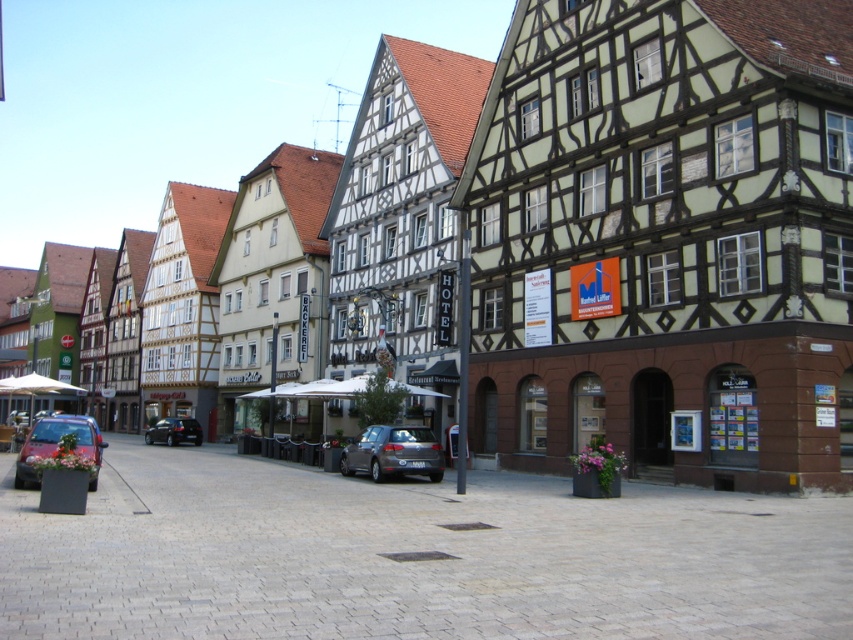
Question: Is satin silver metallic car at center thinner than matte red car at lower left?

Choices:
 (A) yes
 (B) no

Answer: (A)

Question: Which of the following is the closest to the observer?

Choices:
 (A) matte red car at lower left
 (B) satin silver metallic car at center

Answer: (A)

Question: Which is farther from the shiny black sedan at center?

Choices:
 (A) satin silver metallic car at center
 (B) matte red car at lower left

Answer: (A)

Question: Which point is farther to the camera?

Choices:
 (A) satin silver metallic car at center
 (B) shiny black sedan at center

Answer: (B)

Question: Is satin silver metallic car at center below shiny black sedan at center?

Choices:
 (A) no
 (B) yes

Answer: (A)

Question: Does matte red car at lower left appear on the right side of shiny black sedan at center?

Choices:
 (A) yes
 (B) no

Answer: (B)